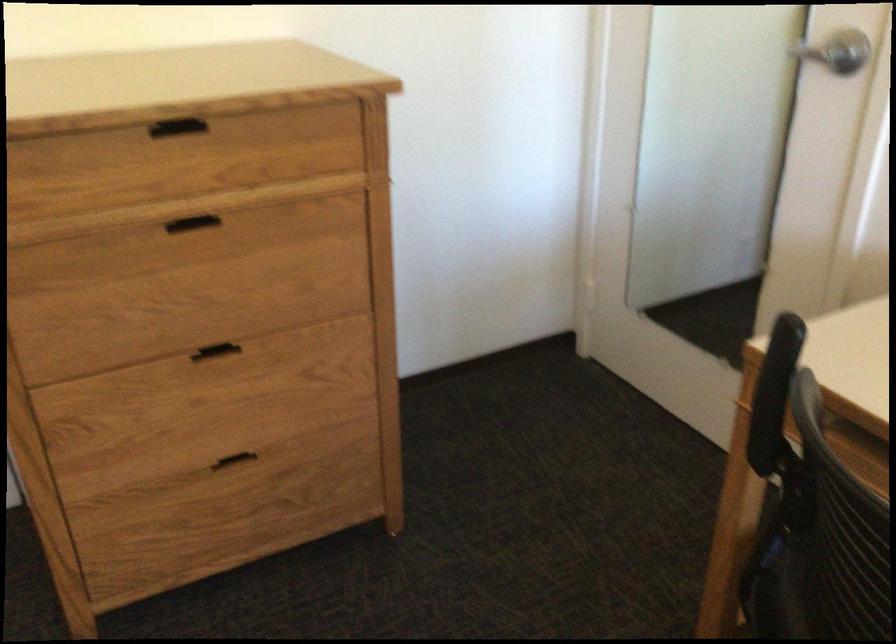
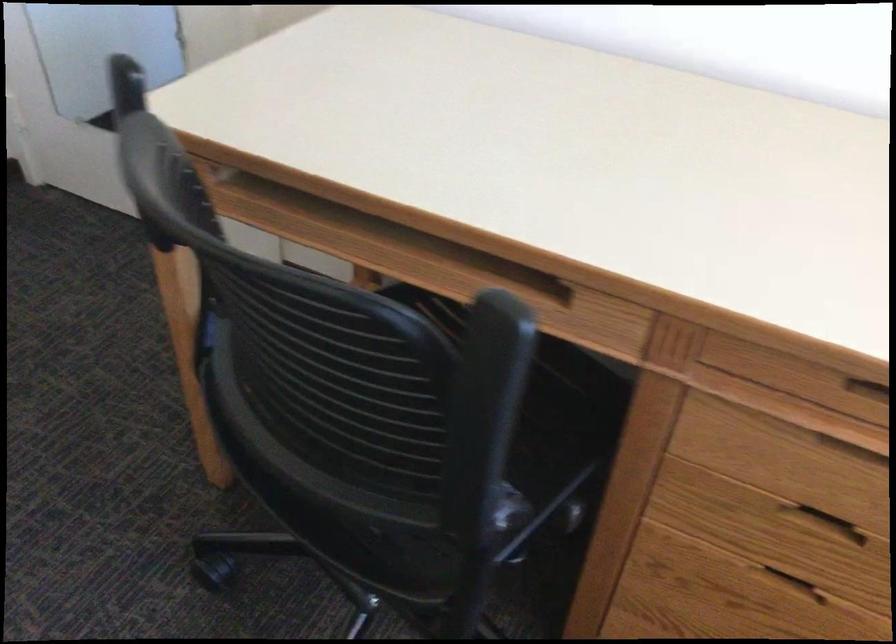
Question: How did the camera likely rotate?

Choices:
 (A) Left
 (B) Right
 (C) Up
 (D) Down

Answer: (B)